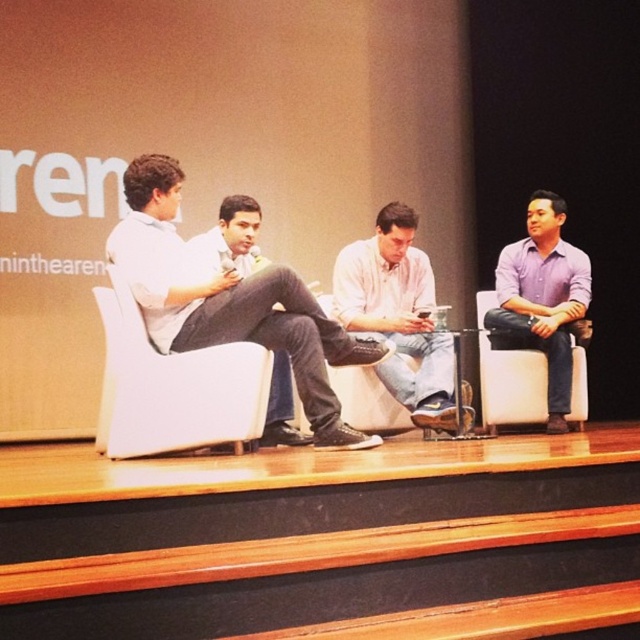
You are an event planner arranging a photo shoot for the panel discussion. You need to position a spotlight between the white fabric armchair at center and the purple matte shirt at right. Based on their positions, will the spotlight fit between them?

The white fabric armchair at center is to the left of purple matte shirt at right, so there is space between them for the spotlight to be placed.

You are sitting in the audience and want to hand a note to both the person wearing the white cotton shirt at center and the person wearing the purple matte shirt at right. Which one should you approach first based on their positions?

You should approach the white cotton shirt at center first because it is closer to the viewer than the purple matte shirt at right.